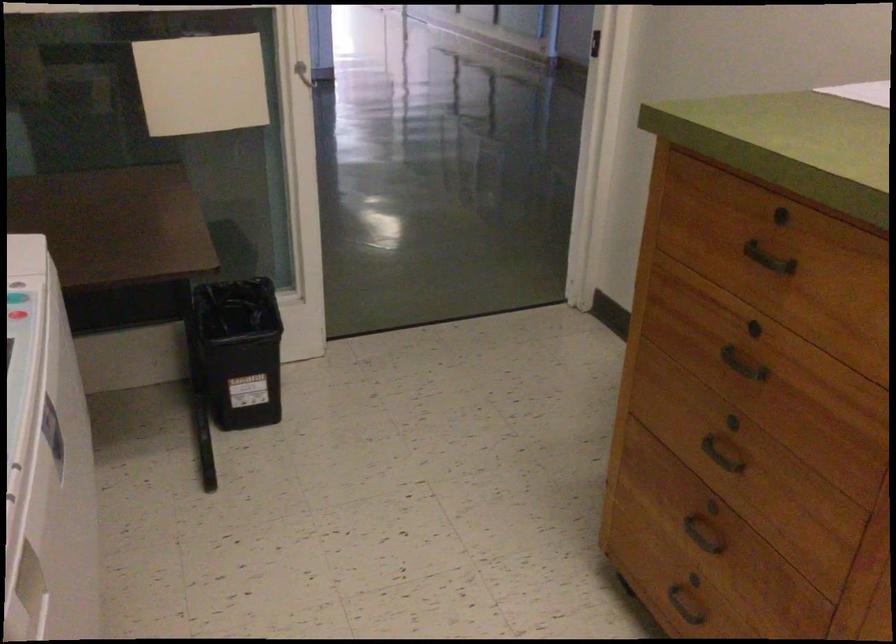
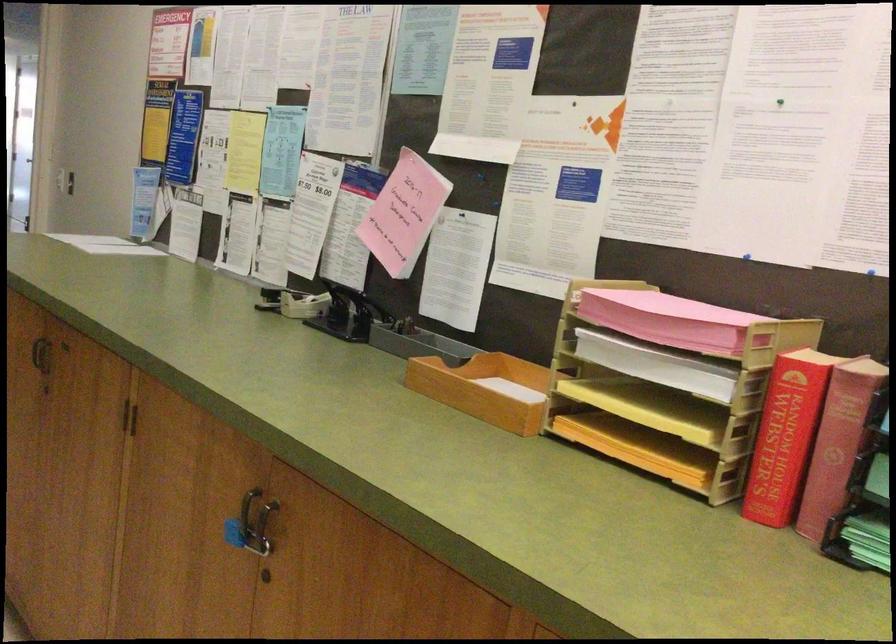
In a continuous first-person perspective shot, in which direction is the camera moving?

The movement direction of the cameraman is right, backward.